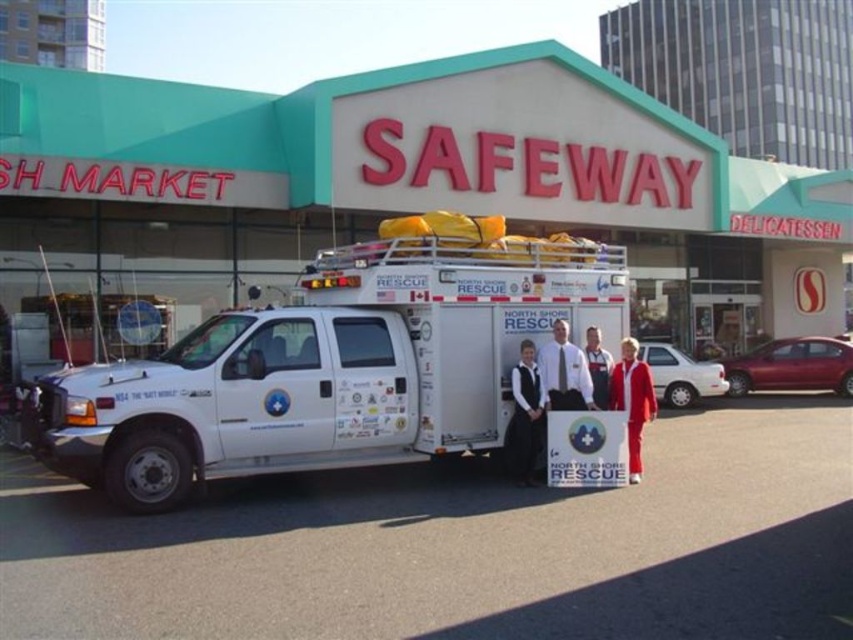
Does point (189, 481) come farther from viewer compared to point (618, 396)?

No.

Between point (460, 285) and point (647, 372), which one is positioned behind?

The point (647, 372) is more distant.

This screenshot has height=640, width=853. I want to click on white matte truck at center, so click(x=329, y=369).

Which is behind, point (7, 221) or point (625, 349)?

The point (7, 221) is behind.

The height and width of the screenshot is (640, 853). Find the location of `white plastic truck at center`. white plastic truck at center is located at coordinates (405, 180).

Who is higher up, black fabric dress at center or matte red suit at center?

Positioned higher is matte red suit at center.

In order to click on black fabric dress at center in this screenshot , I will do `click(525, 419)`.

In order to click on black fabric dress at center in this screenshot , I will do `click(525, 419)`.